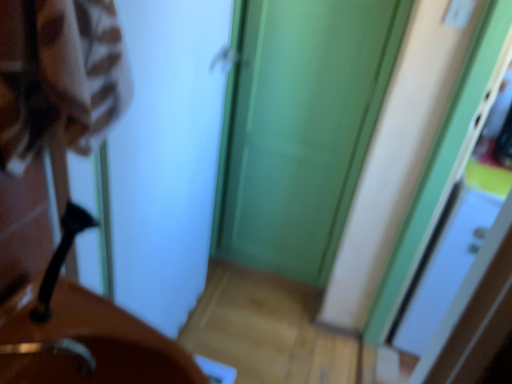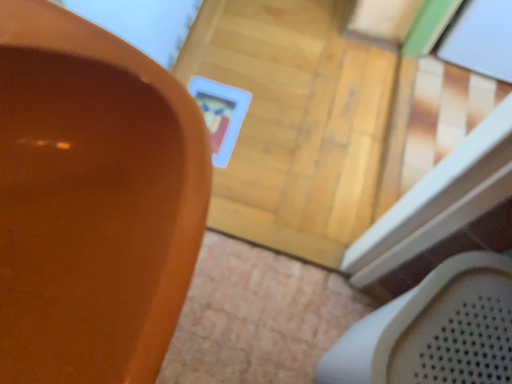
Question: How did the camera likely rotate when shooting the video?

Choices:
 (A) rotated downward
 (B) rotated upward

Answer: (A)